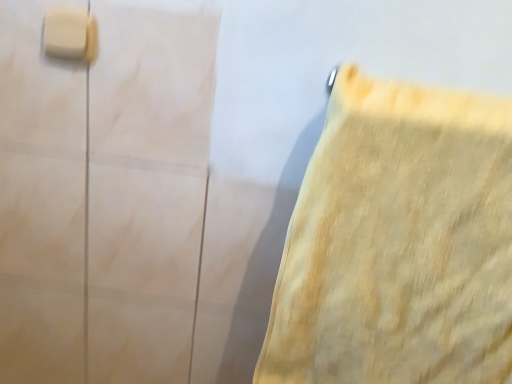
Question: Is yellow fabric towel at right wider or thinner than white matte/light switch at upper left?

Choices:
 (A) thin
 (B) wide

Answer: (B)

Question: Is yellow fabric towel at right situated inside white matte/light switch at upper left or outside?

Choices:
 (A) outside
 (B) inside

Answer: (A)

Question: Based on their positions, is yellow fabric towel at right located to the left or right of white matte/light switch at upper left?

Choices:
 (A) right
 (B) left

Answer: (A)

Question: Would you say white matte/light switch at upper left is inside or outside yellow fabric towel at right?

Choices:
 (A) inside
 (B) outside

Answer: (B)

Question: Is white matte/light switch at upper left wider or thinner than yellow fabric towel at right?

Choices:
 (A) wide
 (B) thin

Answer: (B)

Question: From a real-world perspective, is white matte/light switch at upper left physically located above or below yellow fabric towel at right?

Choices:
 (A) above
 (B) below

Answer: (A)

Question: In the image, is white matte/light switch at upper left positioned in front of or behind yellow fabric towel at right?

Choices:
 (A) behind
 (B) front

Answer: (A)